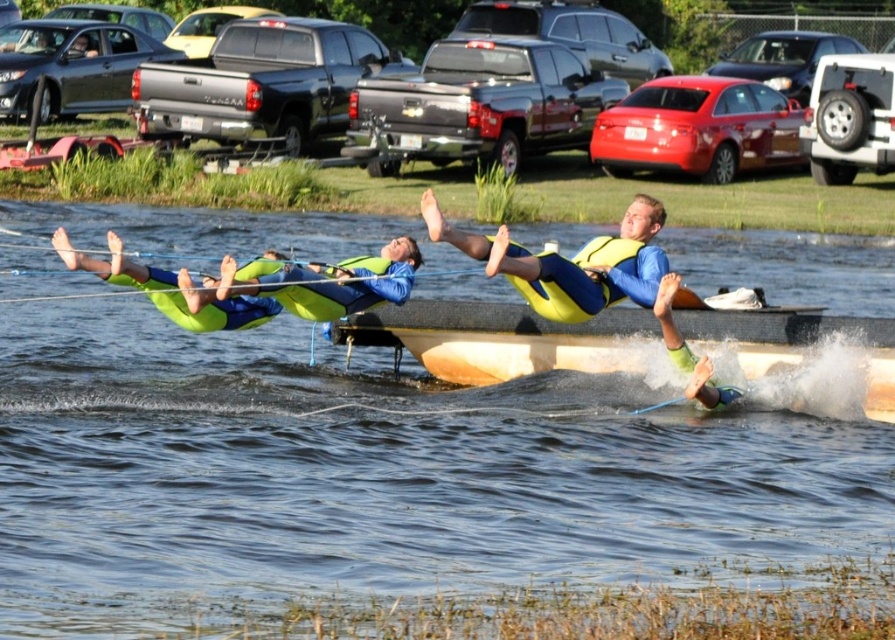
Can you confirm if clear water at center is positioned below green neoprene life vest at center?

Yes.

Does clear water at center have a lesser width compared to green neoprene life vest at center?

No, clear water at center is not thinner than green neoprene life vest at center.

Measure the distance between point (10,536) and camera.

Point (10,536) is 21.03 meters from camera.

Locate an element on the screen. clear water at center is located at coordinates pyautogui.click(x=384, y=476).

Does wooden boat at center have a larger size compared to green neoprene life vest at center?

Yes, wooden boat at center is bigger than green neoprene life vest at center.

What are the coordinates of `wooden boat at center` in the screenshot? It's located at (500, 339).

Is point (887, 349) positioned after point (377, 301)?

No, it is not.

Find the location of a particular element. wooden boat at center is located at coordinates (500, 339).

Based on the photo, between clear water at center and wooden boat at center, which one is positioned lower?

wooden boat at center is lower down.

Locate an element on the screen. The image size is (895, 640). clear water at center is located at coordinates (384, 476).

Measure the distance between clear water at center and camera.

clear water at center is 18.23 meters from camera.

Where is `clear water at center`? This screenshot has width=895, height=640. clear water at center is located at coordinates (384, 476).